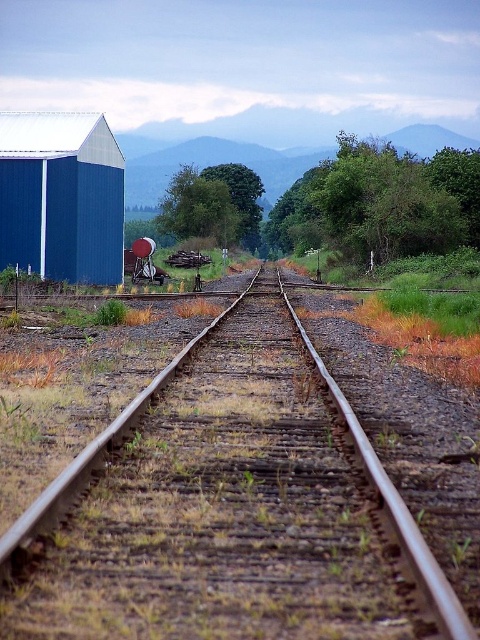
Question: Is rusty metal tracks at center positioned at the back of blue matte barn at left?

Choices:
 (A) no
 (B) yes

Answer: (A)

Question: Which point is closer to the camera?

Choices:
 (A) (74, 236)
 (B) (145, 497)

Answer: (B)

Question: Can you confirm if rusty metal tracks at center is positioned above blue matte barn at left?

Choices:
 (A) no
 (B) yes

Answer: (A)

Question: Is rusty metal tracks at center positioned behind blue matte barn at left?

Choices:
 (A) no
 (B) yes

Answer: (A)